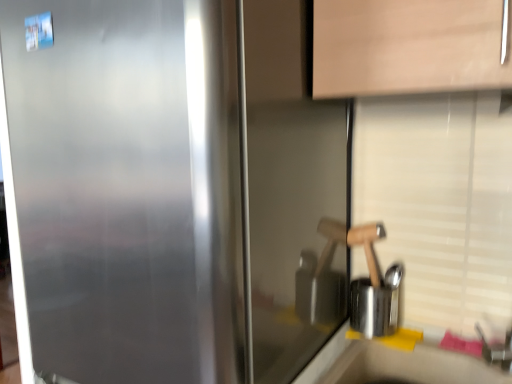
Question: Is wooden handle at right to the left of smooth white countertop at lower right from the viewer's perspective?

Choices:
 (A) no
 (B) yes

Answer: (B)

Question: From the image's perspective, is wooden handle at right beneath smooth white countertop at lower right?

Choices:
 (A) yes
 (B) no

Answer: (B)

Question: From the image's perspective, is wooden handle at right above smooth white countertop at lower right?

Choices:
 (A) yes
 (B) no

Answer: (A)

Question: Considering the relative sizes of wooden handle at right and smooth white countertop at lower right in the image provided, is wooden handle at right shorter than smooth white countertop at lower right?

Choices:
 (A) yes
 (B) no

Answer: (A)

Question: Is wooden handle at right positioned with its back to smooth white countertop at lower right?

Choices:
 (A) no
 (B) yes

Answer: (A)

Question: Is wooden handle at right positioned in front of smooth white countertop at lower right?

Choices:
 (A) yes
 (B) no

Answer: (B)

Question: From a real-world perspective, is wooden handle at right over satin metallic refrigerator at center?

Choices:
 (A) no
 (B) yes

Answer: (A)

Question: Does wooden handle at right have a larger size compared to satin metallic refrigerator at center?

Choices:
 (A) yes
 (B) no

Answer: (B)

Question: Is the position of wooden handle at right more distant than that of satin metallic refrigerator at center?

Choices:
 (A) no
 (B) yes

Answer: (B)

Question: Is wooden handle at right aimed at satin metallic refrigerator at center?

Choices:
 (A) no
 (B) yes

Answer: (A)

Question: Considering the relative positions of wooden handle at right and satin metallic refrigerator at center in the image provided, is wooden handle at right to the left of satin metallic refrigerator at center from the viewer's perspective?

Choices:
 (A) no
 (B) yes

Answer: (A)

Question: Does wooden handle at right contain satin metallic refrigerator at center?

Choices:
 (A) yes
 (B) no

Answer: (B)

Question: From a real-world perspective, is satin metallic refrigerator at center on top of smooth white countertop at lower right?

Choices:
 (A) no
 (B) yes

Answer: (B)